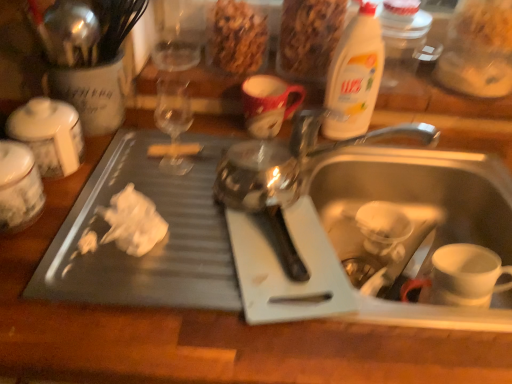
Locate an element on the screen. This screenshot has height=384, width=512. vacant region to the left of crumbly brown granola at upper center, arranged as the second food when viewed from the right is located at coordinates (177, 62).